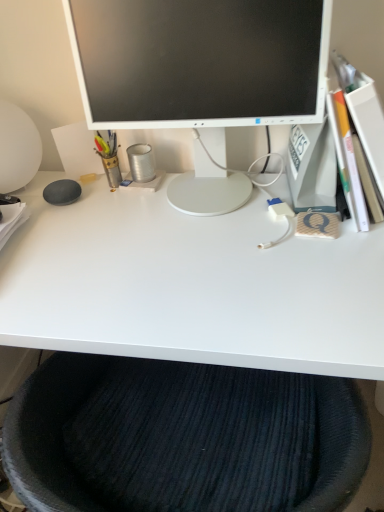
Question: Considering the relative positions of metallic pen holder at left, which is the first stationery from left to right, and white glossy monitor at center in the image provided, is metallic pen holder at left, which is the first stationery from left to right, to the right of white glossy monitor at center from the viewer's perspective?

Choices:
 (A) no
 (B) yes

Answer: (A)

Question: Is metallic pen holder at left, which is the first stationery from left to right, closer to camera compared to white glossy monitor at center?

Choices:
 (A) no
 (B) yes

Answer: (A)

Question: Can you confirm if metallic pen holder at left, which is the first stationery from left to right, is shorter than white glossy monitor at center?

Choices:
 (A) yes
 (B) no

Answer: (A)

Question: From the image's perspective, does metallic pen holder at left, which appears as the second stationery when viewed from the right, appear lower than white glossy monitor at center?

Choices:
 (A) no
 (B) yes

Answer: (B)

Question: From the image's perspective, would you say metallic pen holder at left, which is the first stationery from left to right, is positioned over white glossy monitor at center?

Choices:
 (A) yes
 (B) no

Answer: (B)

Question: Is metallic canister at center, the second stationery in the left-to-right sequence, wider or thinner than white glossy desk at center?

Choices:
 (A) thin
 (B) wide

Answer: (A)

Question: From a real-world perspective, is metallic canister at center, which is the first stationery in right-to-left order, above or below white glossy desk at center?

Choices:
 (A) below
 (B) above

Answer: (B)

Question: Is metallic canister at center, which is the first stationery in right-to-left order, in front of or behind white glossy desk at center in the image?

Choices:
 (A) front
 (B) behind

Answer: (B)

Question: Looking at the image, does metallic canister at center, which is the first stationery in right-to-left order, seem bigger or smaller compared to white glossy desk at center?

Choices:
 (A) big
 (B) small

Answer: (B)

Question: From their relative heights in the image, would you say white glossy desk at center is taller or shorter than metallic canister at center, the second stationery in the left-to-right sequence?

Choices:
 (A) short
 (B) tall

Answer: (B)

Question: Is white glossy desk at center inside or outside of metallic canister at center, the second stationery in the left-to-right sequence?

Choices:
 (A) outside
 (B) inside

Answer: (A)

Question: From a real-world perspective, is white glossy desk at center above or below metallic canister at center, which is the first stationery in right-to-left order?

Choices:
 (A) above
 (B) below

Answer: (B)

Question: From the image's perspective, is white glossy desk at center above or below metallic canister at center, the second stationery in the left-to-right sequence?

Choices:
 (A) below
 (B) above

Answer: (A)

Question: Based on their positions, is white glossy desk at center located to the left or right of dark blue textured cushion at lower center?

Choices:
 (A) left
 (B) right

Answer: (A)

Question: Is white glossy desk at center spatially inside dark blue textured cushion at lower center, or outside of it?

Choices:
 (A) inside
 (B) outside

Answer: (B)